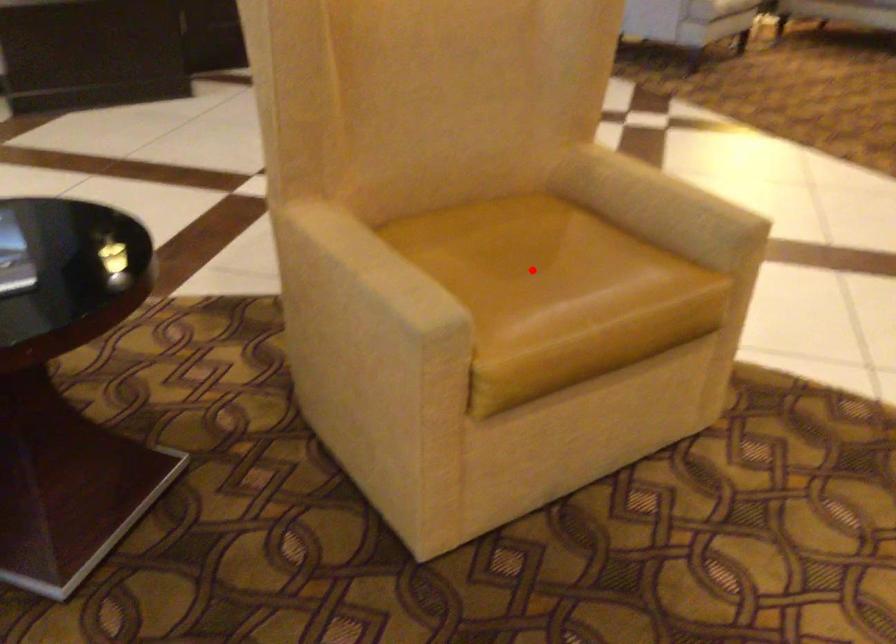
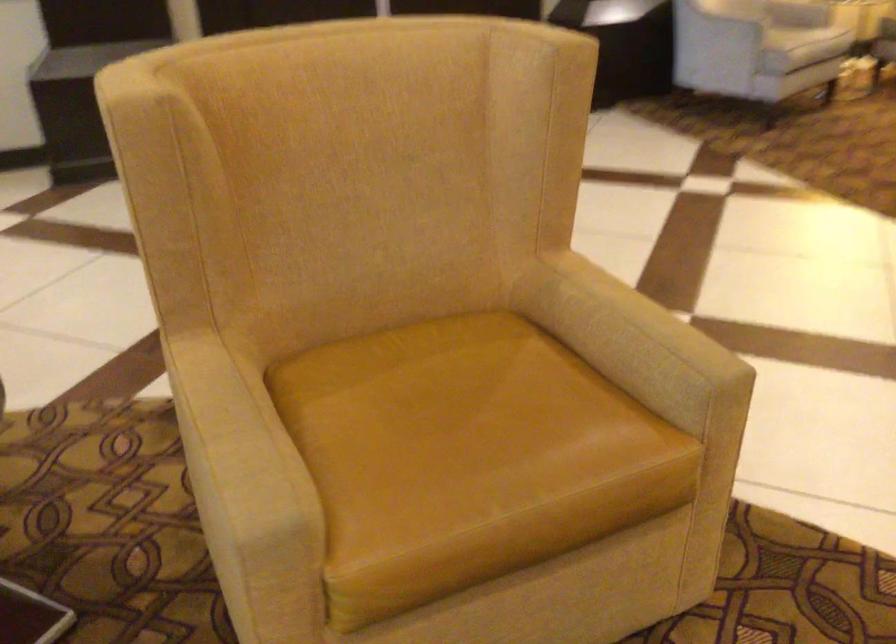
Question: I am providing you with two images of the same scene from different viewpoints. A red point is shown in image1. For the corresponding object point in image2, is it positioned nearer or farther from the camera?

Choices:
 (A) Nearer
 (B) Farther

Answer: (A)